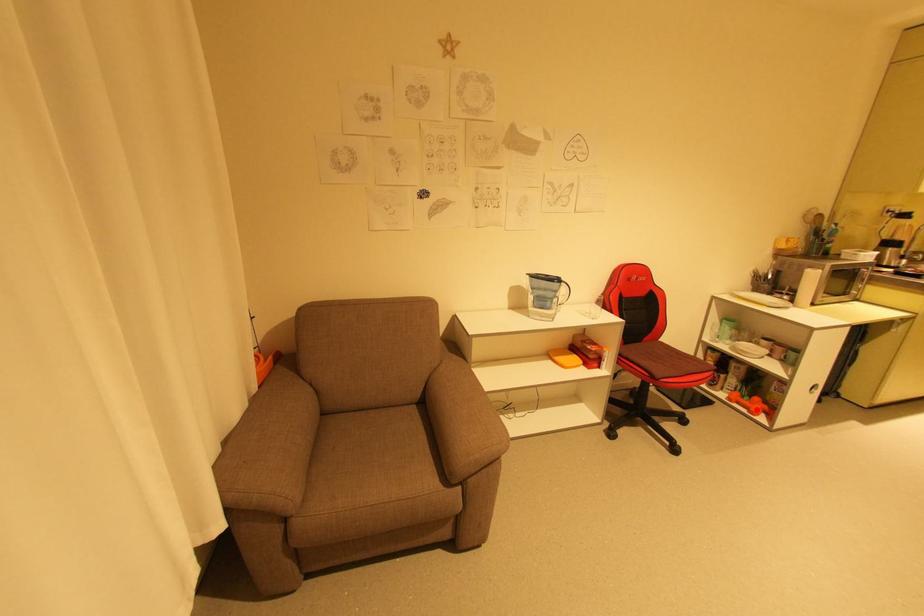
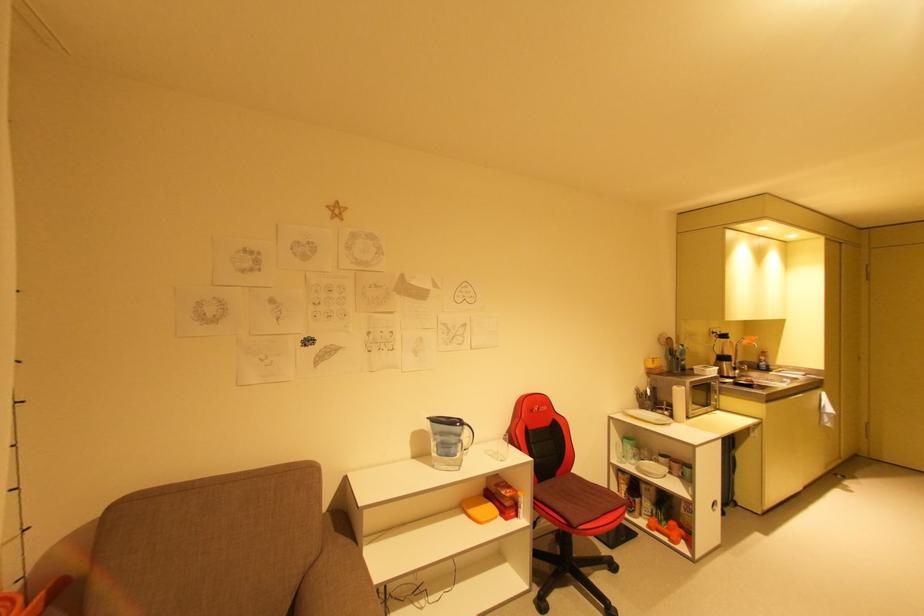
Question: I am providing you with two images of the same scene from different viewpoints. Image1 has a red point marked. In image2, the corresponding 3D location appears at what relative position? Reply with the corresponding letter.

Choices:
 (A) Closer
 (B) Farther

Answer: (B)